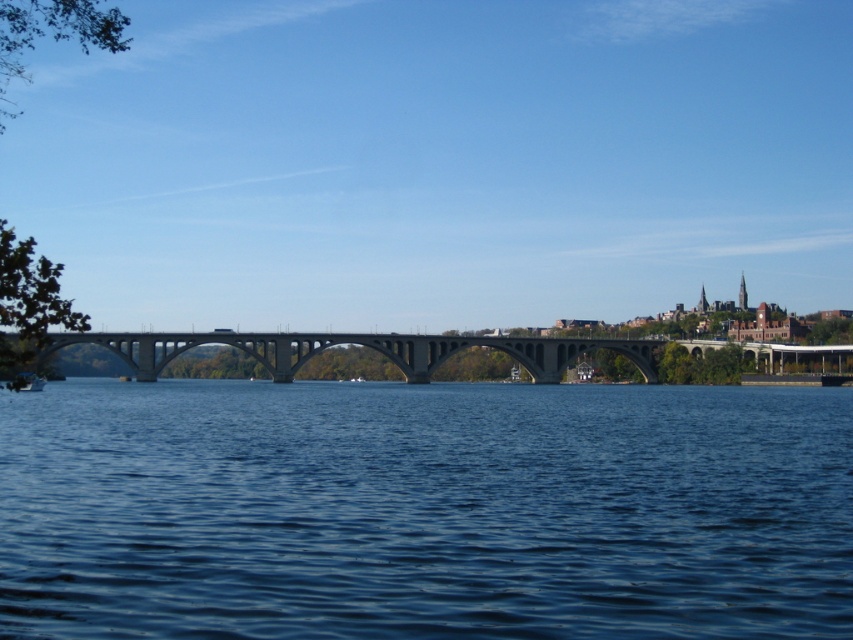
Can you confirm if blue water at center is smaller than concrete bridge at center?

Yes.

Between blue water at center and concrete bridge at center, which one appears on the left side from the viewer's perspective?

Positioned to the left is concrete bridge at center.

You are a GUI agent. You are given a task and a screenshot of the screen. Output one action in this format:
    pyautogui.click(x=<x>, y=<y>)
    Task: Click on the blue water at center
    The height and width of the screenshot is (640, 853).
    Given the screenshot: What is the action you would take?
    pyautogui.click(x=424, y=509)